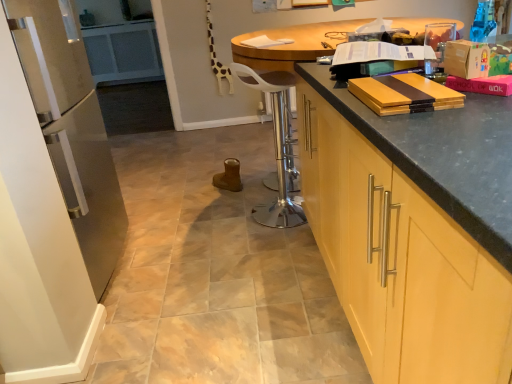
Identify the location of free region on the left part of metallic silver bar stool at center. (222, 219).